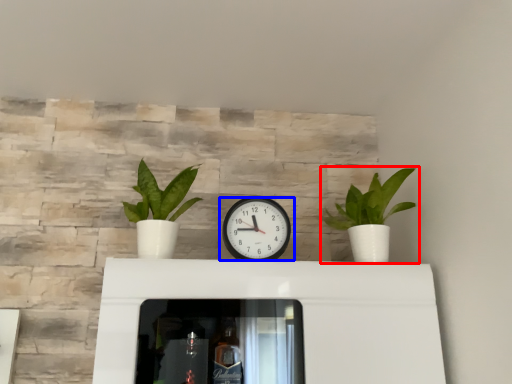
Question: Which of the following is the closest to the observer, houseplant (highlighted by a red box) or wall clock (highlighted by a blue box)?

Choices:
 (A) houseplant
 (B) wall clock

Answer: (A)